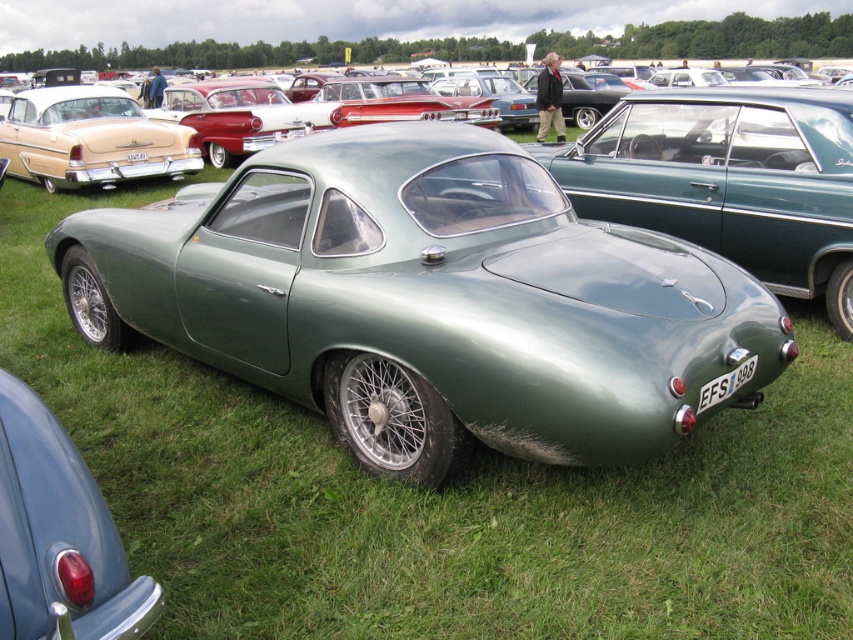
You are standing in the middle of the classic car exhibition and see two points marked on the ground. The first point is at coordinate point (799,77) and the second is at point (102,602). Which point is closer to you?

Point (799,77) is further to the viewer than point (102,602), so the closer point is point (102,602).

You are a photographer trying to capture a photo of the metallic green car at center without any obstructions. However, the matte red taillight at lower left is blocking your view. Can you move to the side to get a clear shot, and if so, which direction should you move?

The metallic green car at center is much taller than the matte red taillight at lower left. Since the car is taller, moving to the side might allow you to position yourself where the taillight no longer blocks the view. Moving to the right or left side could work, but without knowing the exact position of the photographer, it is safer to suggest moving to the side opposite of the taillight. However, based on the description, the taillight is at lower left, so moving to the right side might provide a clearer